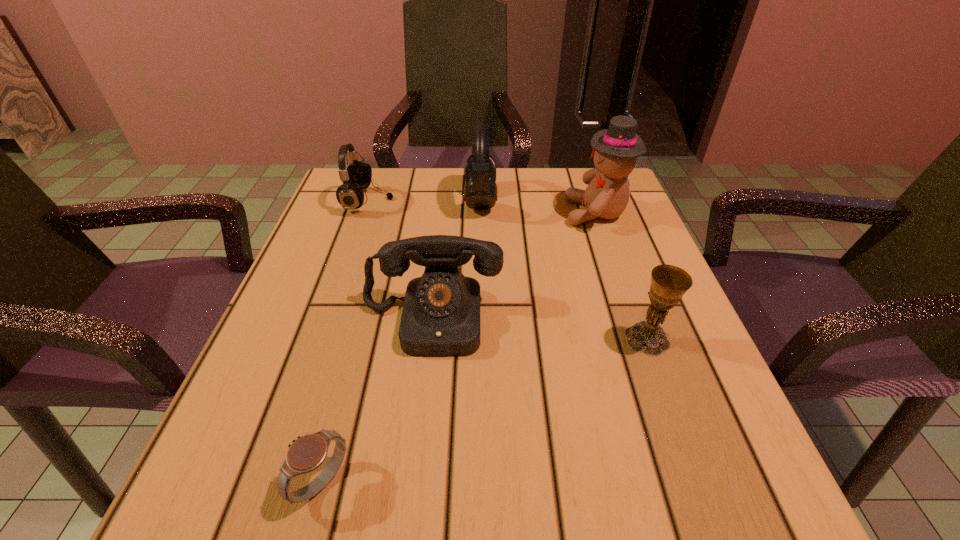
Find the location of a particular element. free space between the nearest object and the telephone is located at coordinates (377, 401).

Identify which object is the fifth closest to the right headset. Please provide its 2D coordinates. Your answer should be formatted as a tuple, i.e. [(x, y)], where the tuple contains the x and y coordinates of a point satisfying the conditions above.

[(307, 453)]

Identify the location of object that ranks as the fourth closest to the nearest object. (358, 175).

Identify the location of vacant position in the image that satisfies the following two spatial constraints: 1. on the front-facing side of the chalice; 2. on the left side of the rag_doll. The height and width of the screenshot is (540, 960). (640, 339).

You are a GUI agent. You are given a task and a screenshot of the screen. Output one action in this format:
    pyautogui.click(x=<x>, y=<y>)
    Task: Click on the vacant space that satisfies the following two spatial constraints: 1. on the earcups of the taller headset; 2. on the dial of the telephone
    
    Given the screenshot: What is the action you would take?
    [x=481, y=320]

This screenshot has height=540, width=960. Identify the location of free space that satisfies the following two spatial constraints: 1. with the microphone on the side of the shorter headset; 2. on the right side of the chalice. (321, 339).

At what (x,y) coordinates should I click in order to perform the action: click on vacant space that satisfies the following two spatial constraints: 1. on the front-facing side of the chalice; 2. on the left side of the rag_doll. Please return your answer as a coordinate pair (x, y). The height and width of the screenshot is (540, 960). Looking at the image, I should click on (640, 339).

This screenshot has width=960, height=540. I want to click on free space that satisfies the following two spatial constraints: 1. on the front-facing side of the rag_doll; 2. on the dial of the telephone, so click(634, 320).

Locate an element on the screen. The width and height of the screenshot is (960, 540). vacant space that satisfies the following two spatial constraints: 1. on the front-facing side of the rag_doll; 2. on the front side of the nearest object is located at coordinates [690, 482].

At what (x,y) coordinates should I click in order to perform the action: click on vacant area in the image that satisfies the following two spatial constraints: 1. on the front-facing side of the rag_doll; 2. on the dial of the telephone. Please return your answer as a coordinate pair (x, y). Looking at the image, I should click on (634, 320).